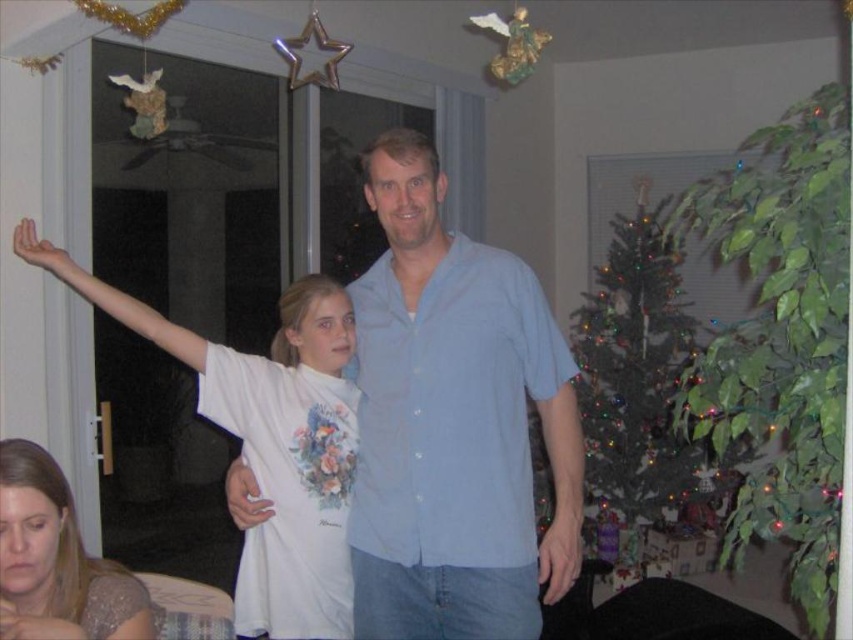
You are planning to hang a star ornament on top of the green matte christmas tree at right. Considering the height of the tree compared to the matte white shirt at lower left, do you think you need a ladder to reach the top?

The green matte christmas tree at right is much taller than the matte white shirt at lower left. Since the tree is significantly taller, you would likely need a ladder to reach the top and hang the star ornament.

Consider the image. You are a delivery person who needs to place a small package between the white cotton shirt at center and the green matte christmas tree at right. The package requires at least 3 meters of space to be placed safely. Can you fit the package between them?

The white cotton shirt at center is 2.71 meters from the green matte christmas tree at right, which is less than the required 3 meters. Therefore, the package cannot be safely placed between them.